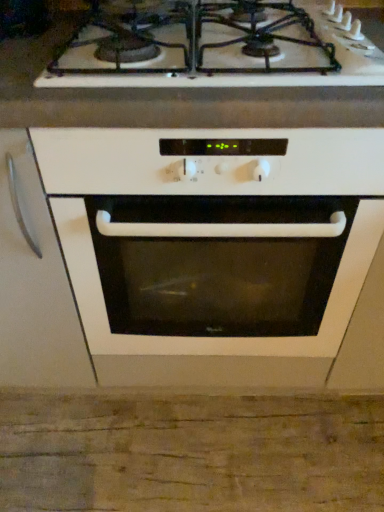
Question: From a real-world perspective, is white glossy oven at center physically located above or below white glossy gas stove at upper center?

Choices:
 (A) below
 (B) above

Answer: (A)

Question: Is point (97, 324) positioned closer to the camera than point (339, 72)?

Choices:
 (A) closer
 (B) farther

Answer: (B)

Question: From the image's perspective, is white glossy oven at center above or below white glossy gas stove at upper center?

Choices:
 (A) above
 (B) below

Answer: (B)

Question: Choose the correct answer: Is white glossy gas stove at upper center inside white glossy oven at center or outside it?

Choices:
 (A) outside
 (B) inside

Answer: (A)

Question: Based on their positions, is white glossy gas stove at upper center located to the left or right of white glossy oven at center?

Choices:
 (A) left
 (B) right

Answer: (A)

Question: Considering the positions of point (302, 13) and point (228, 229), is point (302, 13) closer or farther from the camera than point (228, 229)?

Choices:
 (A) farther
 (B) closer

Answer: (A)

Question: Considering the positions of white glossy gas stove at upper center and white glossy oven at center in the image, is white glossy gas stove at upper center taller or shorter than white glossy oven at center?

Choices:
 (A) short
 (B) tall

Answer: (A)